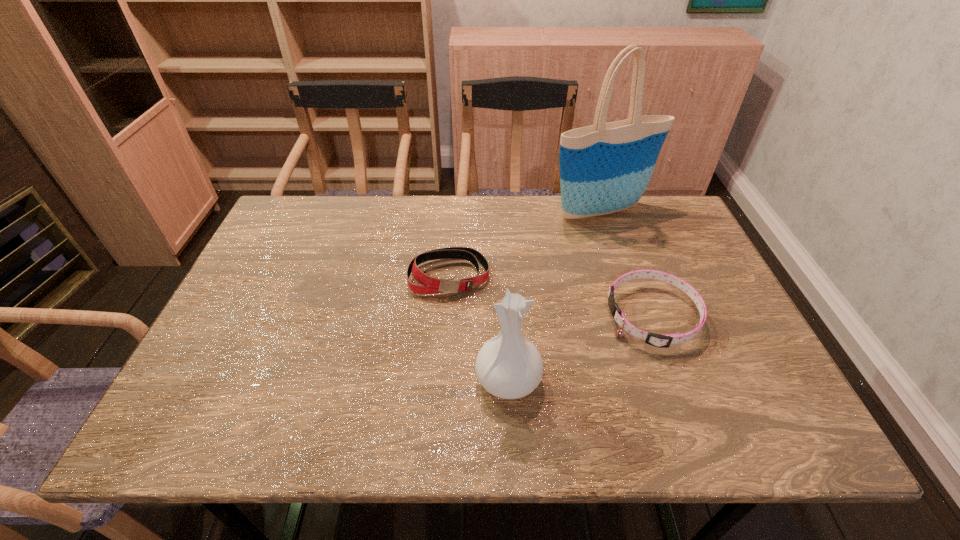
Identify the location of vacant space at the right edge of the desktop. (708, 314).

At what (x,y) coordinates should I click in order to perform the action: click on free space at the far left corner of the desktop. Please return your answer as a coordinate pair (x, y). Looking at the image, I should click on point(328,201).

The width and height of the screenshot is (960, 540). In order to click on empty location between the tote bag and the left dog collar in this screenshot , I will do `click(525, 244)`.

You are a GUI agent. You are given a task and a screenshot of the screen. Output one action in this format:
    pyautogui.click(x=<x>, y=<y>)
    Task: Click on the free spot between the shorter dog collar and the tallest object
    Image resolution: width=960 pixels, height=540 pixels.
    Given the screenshot: What is the action you would take?
    pyautogui.click(x=627, y=264)

At what (x,y) coordinates should I click in order to perform the action: click on free area in between the left dog collar and the tote bag. Please return your answer as a coordinate pair (x, y). Looking at the image, I should click on 525,244.

At what (x,y) coordinates should I click in order to perform the action: click on empty space that is in between the tallest object and the left dog collar. Please return your answer as a coordinate pair (x, y). This screenshot has height=540, width=960. Looking at the image, I should click on (525, 244).

Find the location of `free spot between the shortest object and the left dog collar`. free spot between the shortest object and the left dog collar is located at coordinates (551, 296).

You are a GUI agent. You are given a task and a screenshot of the screen. Output one action in this format:
    pyautogui.click(x=<x>, y=<y>)
    Task: Click on the vacant space in between the second tallest object and the left dog collar
    The height and width of the screenshot is (540, 960).
    Given the screenshot: What is the action you would take?
    pyautogui.click(x=479, y=327)

Find the location of `free area in between the left dog collar and the tallest object`. free area in between the left dog collar and the tallest object is located at coordinates (525, 244).

Find the location of `vacant space in between the second tallest object and the tote bag`. vacant space in between the second tallest object and the tote bag is located at coordinates (555, 295).